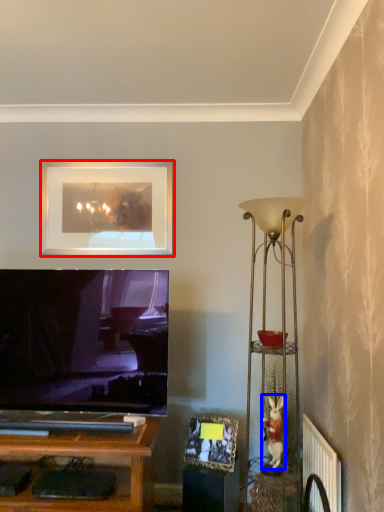
Question: Which object appears closest to the camera in this image, picture frame (highlighted by a red box) or toy (highlighted by a blue box)?

Choices:
 (A) picture frame
 (B) toy

Answer: (B)